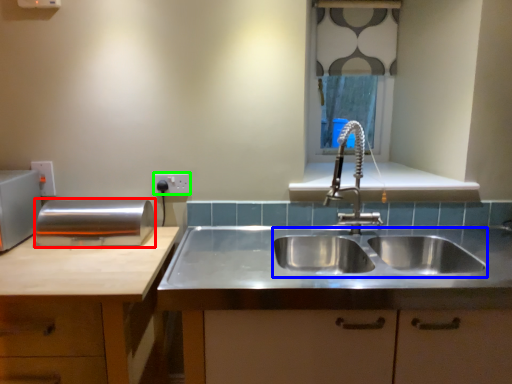
Question: Which object is positioned closest to appliance (highlighted by a red box)? Select from sink (highlighted by a blue box) and electric outlet (highlighted by a green box).

Choices:
 (A) sink
 (B) electric outlet

Answer: (B)